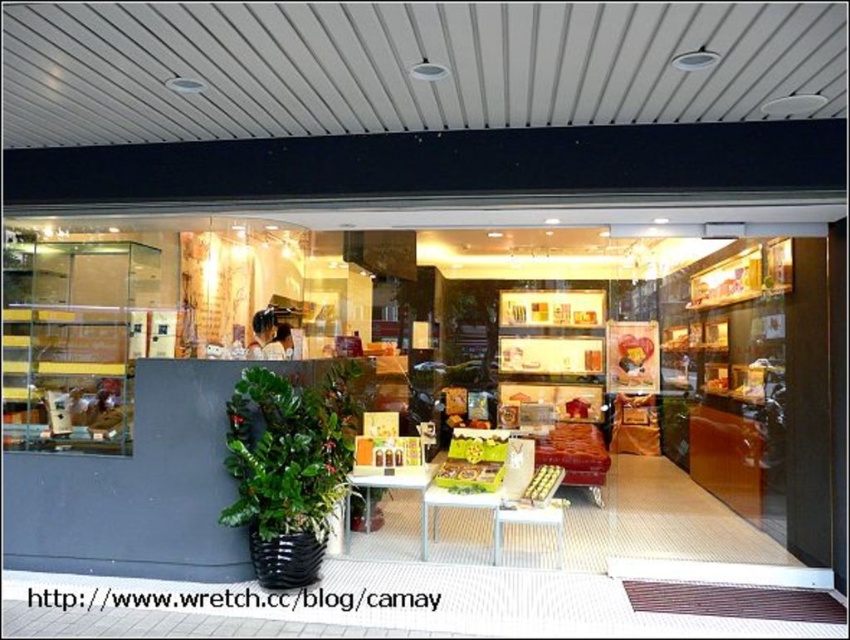
You are a customer entering the shop and want to place a gift box on the surface closest to the entrance. Which object should you use, the matte brown furniture at center or the white glossy table at center?

The white glossy table at center is the correct choice because it is positioned closer to the entrance than the matte brown furniture at center, which is to its right.

You are a customer entering the shop and want to pick up an item from the wooden table at center. Before reaching it, you notice the green matte plant at lower left. Which object is closer to the entrance of the shop?

The green matte plant at lower left is closer to the entrance of the shop because it is positioned to the left of the wooden table at center, meaning it is nearer to the entrance compared to the table.

You are a customer entering the shop and want to see the items on the wooden table at center. However, there is a green matte plant at lower left blocking your view. Can you move the plant to get a better look at the table?

The green matte plant at lower left is above the wooden table at center, so moving the plant might not be necessary as it is already positioned in a way that does not block the view of the table.